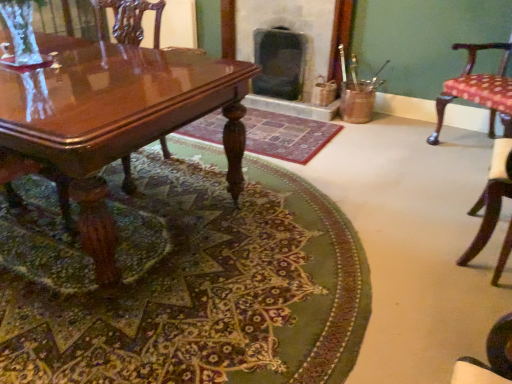
What do you see at coordinates (279, 63) in the screenshot?
I see `dark gray stone fireplace at center, the second fireplace from the left` at bounding box center [279, 63].

Describe the element at coordinates (490, 199) in the screenshot. I see `patterned fabric cushion at right, which appears as the 2th chair when viewed from the left` at that location.

Identify the location of dark gray stone fireplace at center, the first fireplace when ordered from left to right. (282, 25).

Locate an element on the screen. glossy wood coffee table at lower left is located at coordinates (115, 122).

This screenshot has height=384, width=512. In order to click on dark gray stone fireplace at center, the first fireplace viewed from the right in this screenshot , I will do tap(279, 63).

Which object is further away from the camera taking this photo, green woven rug at center, positioned as the 2th mat in front-to-back order, or patterned fabric cushion at right, which appears as the 2th chair when viewed from the left?

green woven rug at center, positioned as the 2th mat in front-to-back order, is further from the camera.

Between green woven rug at center, positioned as the 2th mat in front-to-back order, and patterned fabric cushion at right, which appears as the 2th chair when viewed from the left, which one appears on the left side from the viewer's perspective?

green woven rug at center, positioned as the 2th mat in front-to-back order.

Is point (307, 159) behind point (505, 166)?

Yes, it is.

How many degrees apart are the facing directions of green woven rug at center, positioned as the 2th mat in front-to-back order, and patterned fabric cushion at right, which appears as the 2th chair when viewed from the left?

They differ by 90.5 degrees in their facing directions.

Can you tell me how much carpeted floor at center, which is counted as the first mat, starting from the front, and glossy wood chair at left, placed as the first chair when sorted from left to right, differ in facing direction?

5.16 degrees separate the facing orientations of carpeted floor at center, which is counted as the first mat, starting from the front, and glossy wood chair at left, placed as the first chair when sorted from left to right.

Is point (45, 226) in front of point (132, 189)?

Yes, point (45, 226) is closer to viewer.

Does carpeted floor at center, placed as the 2th mat when sorted from back to front, have a lesser height compared to glossy wood chair at left, placed as the first chair when sorted from left to right?

Yes.

From the image's perspective, is carpeted floor at center, which is counted as the first mat, starting from the front, above or below glossy wood chair at left, the third chair from the right?

Clearly, from the image's perspective, carpeted floor at center, which is counted as the first mat, starting from the front, is below glossy wood chair at left, the third chair from the right.

Is glossy wood coffee table at lower left turned away from dark gray stone fireplace at center, the second fireplace from the left?

Yes.

Between glossy wood coffee table at lower left and dark gray stone fireplace at center, the first fireplace viewed from the right, which one has more height?

glossy wood coffee table at lower left is taller.

Considering the positions of points (121, 79) and (283, 33), is point (121, 79) closer to camera compared to point (283, 33)?

That is True.

In terms of size, does glossy wood coffee table at lower left appear bigger or smaller than dark gray stone fireplace at center, the first fireplace viewed from the right?

Considering their sizes, glossy wood coffee table at lower left takes up more space than dark gray stone fireplace at center, the first fireplace viewed from the right.

Does dark gray stone fireplace at center, the second fireplace from the left, have a smaller size compared to carpeted floor at center, which is counted as the first mat, starting from the front?

Correct, dark gray stone fireplace at center, the second fireplace from the left, occupies less space than carpeted floor at center, which is counted as the first mat, starting from the front.

Between dark gray stone fireplace at center, the first fireplace viewed from the right, and carpeted floor at center, which is counted as the first mat, starting from the front, which one has smaller width?

With smaller width is dark gray stone fireplace at center, the first fireplace viewed from the right.

Based on the photo, considering the sizes of objects dark gray stone fireplace at center, the first fireplace viewed from the right, and carpeted floor at center, placed as the 2th mat when sorted from back to front, in the image provided, who is shorter, dark gray stone fireplace at center, the first fireplace viewed from the right, or carpeted floor at center, placed as the 2th mat when sorted from back to front,?

carpeted floor at center, placed as the 2th mat when sorted from back to front.

The width and height of the screenshot is (512, 384). Identify the location of the 2nd fireplace behind the carpeted floor at center, placed as the 2th mat when sorted from back to front. (279, 63).

Locate an element on the screen. the 1st mat positioned below the polka dot fabric chair at right, the first chair positioned from the right (from a real-world perspective) is located at coordinates (186, 282).

From the image's perspective, which one is positioned lower, polka dot fabric chair at right, which is counted as the 3th chair, starting from the left, or carpeted floor at center, which is counted as the first mat, starting from the front?

carpeted floor at center, which is counted as the first mat, starting from the front, from the image's perspective.

From a real-world perspective, who is located higher, polka dot fabric chair at right, which is counted as the 3th chair, starting from the left, or carpeted floor at center, which is counted as the first mat, starting from the front?

polka dot fabric chair at right, which is counted as the 3th chair, starting from the left, is physically above.

Between dark gray stone fireplace at center, the second fireplace from the left, and glossy wood chair at left, placed as the first chair when sorted from left to right, which one appears on the left side from the viewer's perspective?

glossy wood chair at left, placed as the first chair when sorted from left to right, is more to the left.

Does dark gray stone fireplace at center, the second fireplace from the left, come in front of glossy wood chair at left, placed as the first chair when sorted from left to right?

That is False.

Is dark gray stone fireplace at center, the second fireplace from the left, touching glossy wood chair at left, the third chair from the right?

No, dark gray stone fireplace at center, the second fireplace from the left, is not touching glossy wood chair at left, the third chair from the right.

Considering the sizes of objects dark gray stone fireplace at center, the first fireplace viewed from the right, and glossy wood chair at left, the third chair from the right, in the image provided, who is bigger, dark gray stone fireplace at center, the first fireplace viewed from the right, or glossy wood chair at left, the third chair from the right,?

Bigger between the two is glossy wood chair at left, the third chair from the right.

Is green woven rug at center, placed as the first mat when sorted from back to front, next to glossy wood coffee table at lower left and touching it?

No, green woven rug at center, placed as the first mat when sorted from back to front, is not making contact with glossy wood coffee table at lower left.

From the image's perspective, is green woven rug at center, placed as the first mat when sorted from back to front, positioned above or below glossy wood coffee table at lower left?

green woven rug at center, placed as the first mat when sorted from back to front, is situated higher than glossy wood coffee table at lower left in the image.

Which of these two, green woven rug at center, placed as the first mat when sorted from back to front, or glossy wood coffee table at lower left, is thinner?

green woven rug at center, placed as the first mat when sorted from back to front, is thinner.

You are a GUI agent. You are given a task and a screenshot of the screen. Output one action in this format:
    pyautogui.click(x=<x>, y=<y>)
    Task: Click on the 1st chair to the right when counting from the green woven rug at center, placed as the first mat when sorted from back to front
    
    Given the screenshot: What is the action you would take?
    pyautogui.click(x=490, y=199)

Where is `the 3rd chair located above the carpeted floor at center, which is counted as the first mat, starting from the front (from a real-world perspective)`? The image size is (512, 384). the 3rd chair located above the carpeted floor at center, which is counted as the first mat, starting from the front (from a real-world perspective) is located at coordinates (34, 173).

From the image, which object appears to be nearer to glossy wood coffee table at lower left, dark gray stone fireplace at center, arranged as the 2th fireplace when viewed from the right, or green woven rug at center, positioned as the 2th mat in front-to-back order?

green woven rug at center, positioned as the 2th mat in front-to-back order, is positioned closer to the anchor glossy wood coffee table at lower left.

In the scene shown: When comparing their distances from carpeted floor at center, which is counted as the first mat, starting from the front, does patterned fabric cushion at right, which is the 2th chair from right to left, or glossy wood chair at left, the third chair from the right, seem closer?

Among the two, glossy wood chair at left, the third chair from the right, is located nearer to carpeted floor at center, which is counted as the first mat, starting from the front.

Considering their positions, is dark gray stone fireplace at center, the first fireplace when ordered from left to right, positioned closer to carpeted floor at center, which is counted as the first mat, starting from the front, than dark gray stone fireplace at center, the second fireplace from the left?

dark gray stone fireplace at center, the second fireplace from the left, lies closer to carpeted floor at center, which is counted as the first mat, starting from the front, than the other object.

Estimate the real-world distances between objects in this image. Which object is closer to green woven rug at center, placed as the first mat when sorted from back to front, patterned fabric cushion at right, which appears as the 2th chair when viewed from the left, or carpeted floor at center, which is counted as the first mat, starting from the front?

Based on the image, carpeted floor at center, which is counted as the first mat, starting from the front, appears to be nearer to green woven rug at center, placed as the first mat when sorted from back to front.

From the image, which object appears to be nearer to dark gray stone fireplace at center, the second fireplace from the left, glossy wood chair at left, the third chair from the right, or carpeted floor at center, which is counted as the first mat, starting from the front?

carpeted floor at center, which is counted as the first mat, starting from the front, lies closer to dark gray stone fireplace at center, the second fireplace from the left, than the other object.

From the picture: From the image, which object appears to be nearer to carpeted floor at center, which is counted as the first mat, starting from the front, glossy wood chair at left, the third chair from the right, or glossy wood coffee table at lower left?

Among the two, glossy wood coffee table at lower left is located nearer to carpeted floor at center, which is counted as the first mat, starting from the front.

Considering their positions, is polka dot fabric chair at right, the first chair positioned from the right, positioned further to dark gray stone fireplace at center, arranged as the 2th fireplace when viewed from the right, than dark gray stone fireplace at center, the second fireplace from the left?

polka dot fabric chair at right, the first chair positioned from the right.

Which object lies further to the anchor point green woven rug at center, placed as the first mat when sorted from back to front, glossy wood chair at left, the third chair from the right, or dark gray stone fireplace at center, the first fireplace when ordered from left to right?

glossy wood chair at left, the third chair from the right.

I want to click on mat located between carpeted floor at center, placed as the 2th mat when sorted from back to front, and polka dot fabric chair at right, which is counted as the 3th chair, starting from the left, in the left-right direction, so click(286, 135).

At what (x,y) coordinates should I click in order to perform the action: click on mat located between carpeted floor at center, which is counted as the first mat, starting from the front, and dark gray stone fireplace at center, the first fireplace when ordered from left to right, in the depth direction. Please return your answer as a coordinate pair (x, y). Looking at the image, I should click on (x=286, y=135).

This screenshot has height=384, width=512. I want to click on fireplace between patterned fabric cushion at right, which appears as the 2th chair when viewed from the left, and dark gray stone fireplace at center, the first fireplace viewed from the right, in the front-back direction, so click(282, 25).

You are a GUI agent. You are given a task and a screenshot of the screen. Output one action in this format:
    pyautogui.click(x=<x>, y=<y>)
    Task: Click on the mat positioned between glossy wood chair at left, the third chair from the right, and dark gray stone fireplace at center, the first fireplace when ordered from left to right, from near to far
    The width and height of the screenshot is (512, 384).
    Given the screenshot: What is the action you would take?
    pyautogui.click(x=286, y=135)